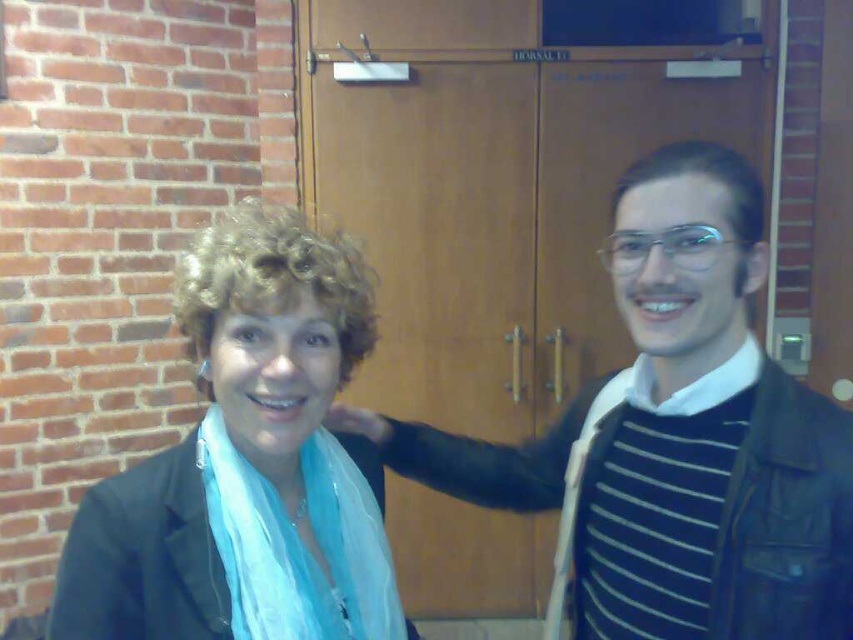
You are a tailor measuring two garments in the image. The striped knit sweater at center and the matte black jacket at left. Which garment is positioned to the right of the other?

The striped knit sweater at center is positioned on the right side of matte black jacket at left.

You are an interior designer observing the scene. You need to adjust the placement of the striped knit sweater at center and the light blue silky scarf at center so that the scarf is now above the sweater. Is this possible without moving the people in the image?

The striped knit sweater at center is currently above the light blue silky scarf at center. To place the scarf above the sweater without moving the people, you would need to adjust their clothing arrangement, which isn

You are a photographer setting up for a portrait. You have two focal points in the image, the striped knit sweater at center and the light blue silky scarf at center. You need to ensure that both items are in focus. If your camera has a depth of field that can cover 30 centimeters, will both items be in focus?

The striped knit sweater at center is 30.77 centimeters away from the light blue silky scarf at center. Since the distance between them exceeds the camera lens depth of field coverage of 30 centimeters, the two items may not both be in focus simultaneously.